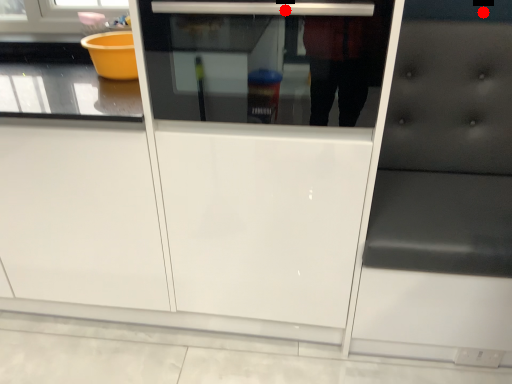
Question: Two points are circled on the image, labeled by A and B beside each circle. Which of the following is the farthest from the observer?

Choices:
 (A) A is further
 (B) B is further

Answer: (B)